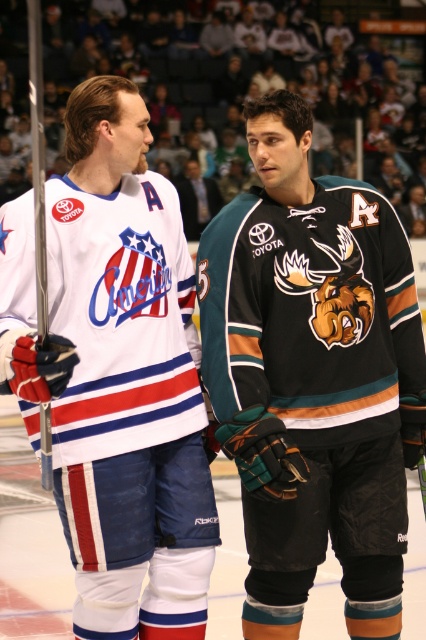
The height and width of the screenshot is (640, 426). What are the coordinates of `teal jersey at center` in the screenshot? It's located at (313, 378).

Is teal jersey at center further to camera compared to dark blue jersey at center?

No.

The image size is (426, 640). Find the location of `teal jersey at center`. teal jersey at center is located at coordinates (313, 378).

Is teal jersey at center below white matte hockey jersey at left?

Indeed, teal jersey at center is positioned under white matte hockey jersey at left.

Between teal jersey at center and white matte hockey jersey at left, which one appears on the right side from the viewer's perspective?

Positioned to the right is teal jersey at center.

Between point (285, 326) and point (187, 368), which one is positioned behind?

The point (285, 326) is behind.

At what (x,y) coordinates should I click in order to perform the action: click on teal jersey at center. Please return your answer as a coordinate pair (x, y). The height and width of the screenshot is (640, 426). Looking at the image, I should click on (313, 378).

Does white matte hockey jersey at left come in front of dark blue jersey at center?

That is True.

Who is taller, white matte hockey jersey at left or dark blue jersey at center?

white matte hockey jersey at left

Does point (132, 528) come farther from viewer compared to point (213, 208)?

No, (132, 528) is closer to viewer.

The width and height of the screenshot is (426, 640). I want to click on white matte hockey jersey at left, so click(x=115, y=372).